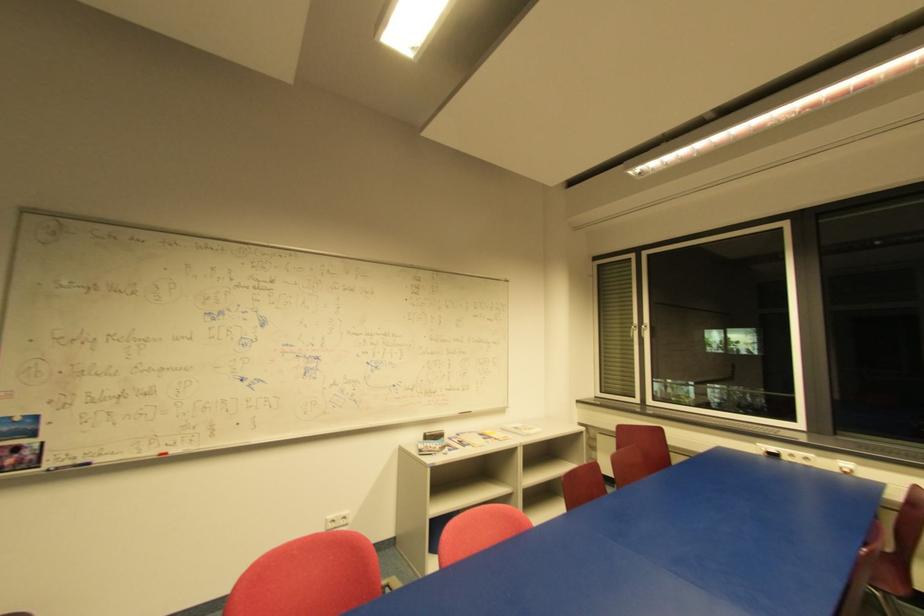
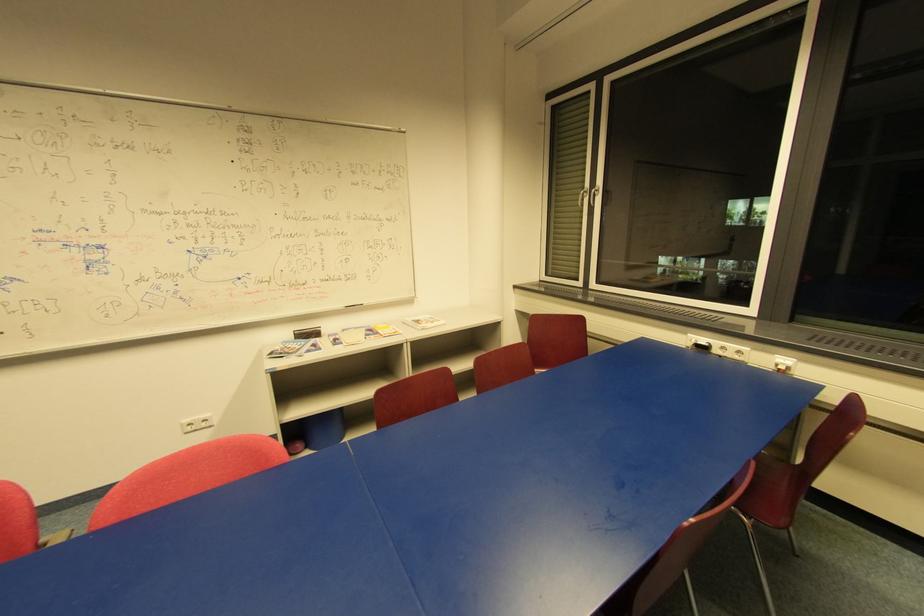
Locate, in the second image, the point that corresponds to pixel 647 328 in the first image.

(598, 192)